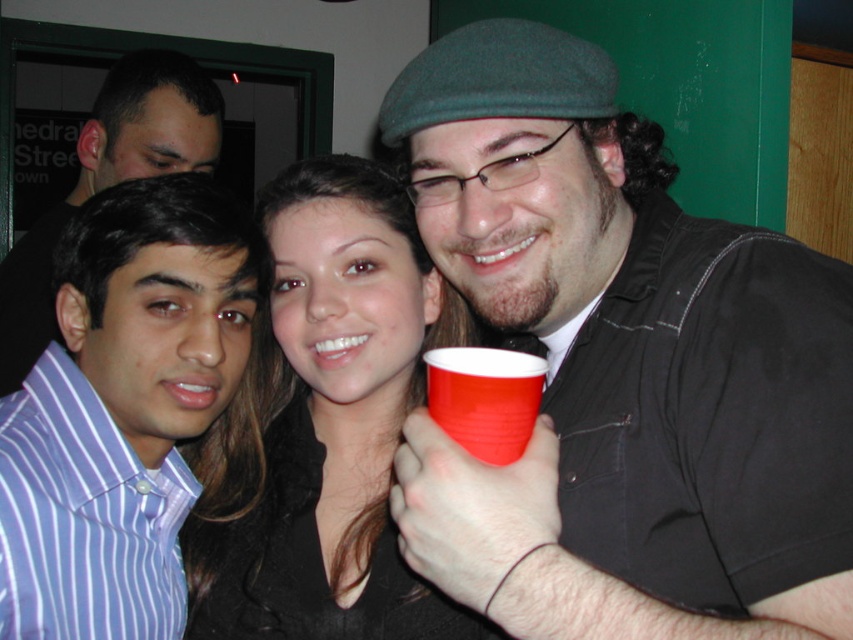
You are at a party and see the matte black shirt at center and the matte plastic cup at center. Which one is positioned higher in the image?

The matte black shirt at center is above the matte plastic cup at center, so the matte black shirt at center is positioned higher.

You are at a party and want to hand a small gift to the person wearing the matte black shirt at center without accidentally hitting the matte plastic cup at center. Which object should you avoid knocking over when approaching?

The matte plastic cup at center is smaller than the matte black shirt at center, so you should avoid knocking over the matte plastic cup at center when approaching.